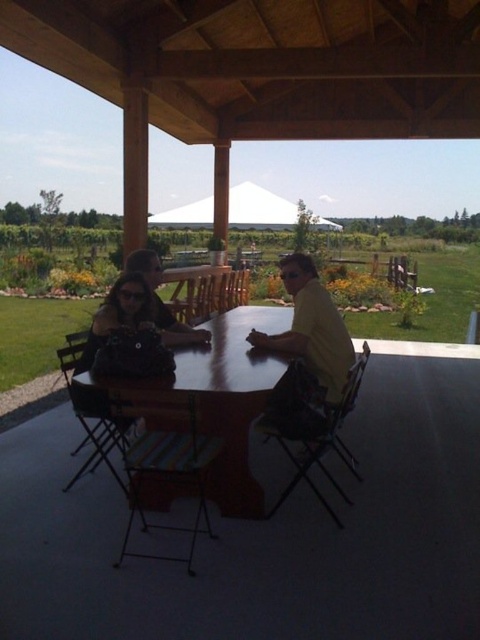
Does wooden table at center come in front of yellow matte shirt at center?

Yes.

Can you confirm if wooden table at center is bigger than yellow matte shirt at center?

Correct, wooden table at center is larger in size than yellow matte shirt at center.

The height and width of the screenshot is (640, 480). I want to click on wooden table at center, so click(225, 397).

Locate an element on the screen. wooden table at center is located at coordinates (225, 397).

Is point (335, 339) more distant than point (332, 225)?

No, (335, 339) is closer to viewer.

Based on the photo, which is more to the right, yellow matte shirt at center or white fabric canopy at upper center?

Positioned to the right is white fabric canopy at upper center.

Is point (298, 419) positioned after point (263, 202)?

No, (298, 419) is in front of (263, 202).

Locate an element on the screen. The image size is (480, 640). yellow matte shirt at center is located at coordinates (307, 355).

Who is shorter, wooden table at center or white fabric canopy at upper center?

wooden table at center is shorter.

Is wooden table at center positioned behind white fabric canopy at upper center?

No, wooden table at center is closer to the viewer.

Which is behind, point (191, 374) or point (276, 225)?

Positioned behind is point (276, 225).

Image resolution: width=480 pixels, height=640 pixels. I want to click on wooden table at center, so click(x=225, y=397).